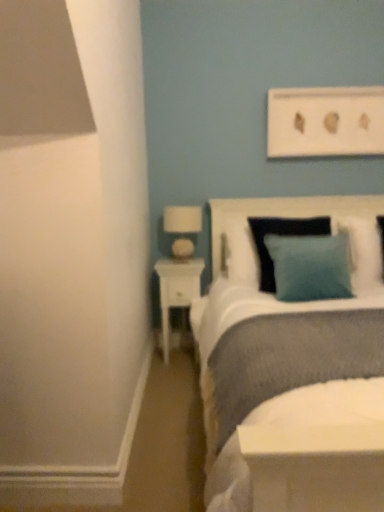
Question: From the image's perspective, is textured white headboard at upper right above or below white glossy nightstand at lower left?

Choices:
 (A) below
 (B) above

Answer: (B)

Question: Considering the positions of textured white headboard at upper right and white glossy nightstand at lower left in the image, is textured white headboard at upper right bigger or smaller than white glossy nightstand at lower left?

Choices:
 (A) big
 (B) small

Answer: (A)

Question: Estimate the real-world distances between objects in this image. Which object is farther from the textured white headboard at upper right?

Choices:
 (A) white glossy nightstand at lower left
 (B) white fabric lampshade at upper left
 (C) teal fabric pillow at upper right, the 2th pillow viewed from the left
 (D) teal fabric pillow at center, which ranks as the 2th pillow in right-to-left order

Answer: (D)

Question: Based on their relative distances, which object is nearer to the teal fabric pillow at center, positioned as the first pillow in left-to-right order?

Choices:
 (A) teal fabric pillow at upper right, which is the first pillow in right-to-left order
 (B) white fabric lampshade at upper left
 (C) textured white headboard at upper right
 (D) white glossy nightstand at lower left

Answer: (A)